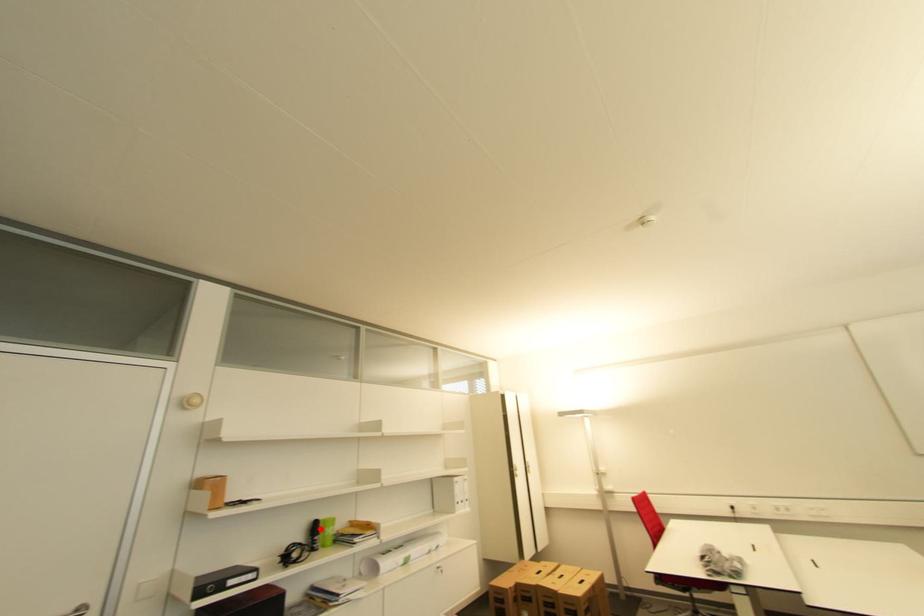
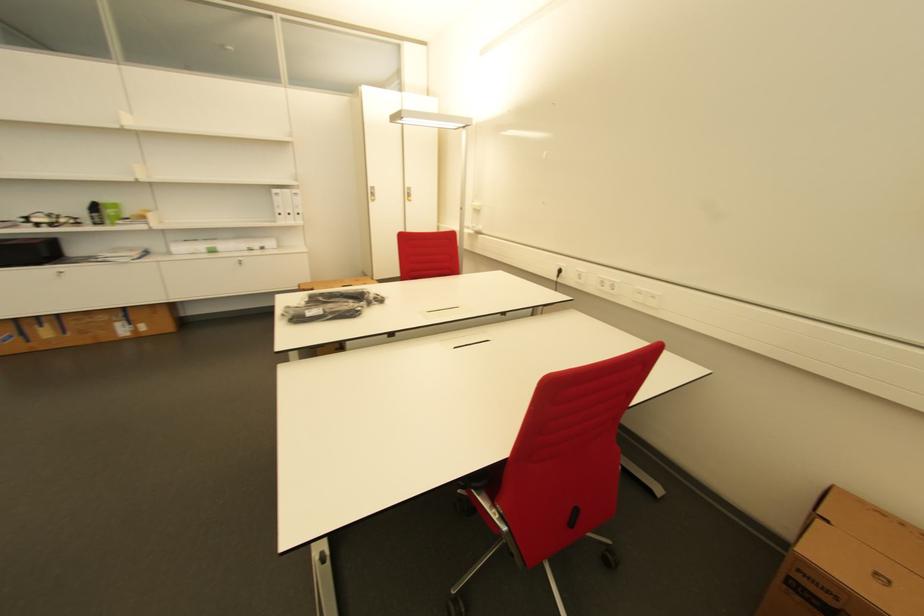
The point at the highlighted location is marked in the first image. Where is the corresponding point in the second image?

(100, 209)